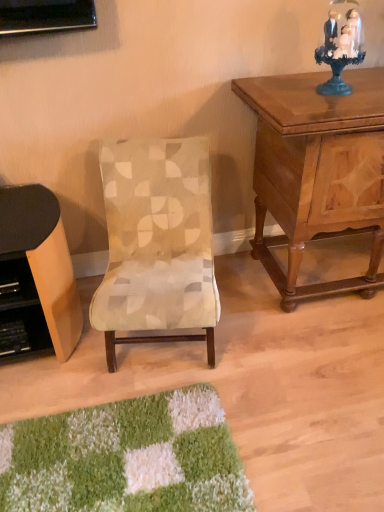
Image resolution: width=384 pixels, height=512 pixels. What are the coordinates of `free location above wooden nightstand at upper right (from a real-world perspective)` in the screenshot? It's located at (334, 93).